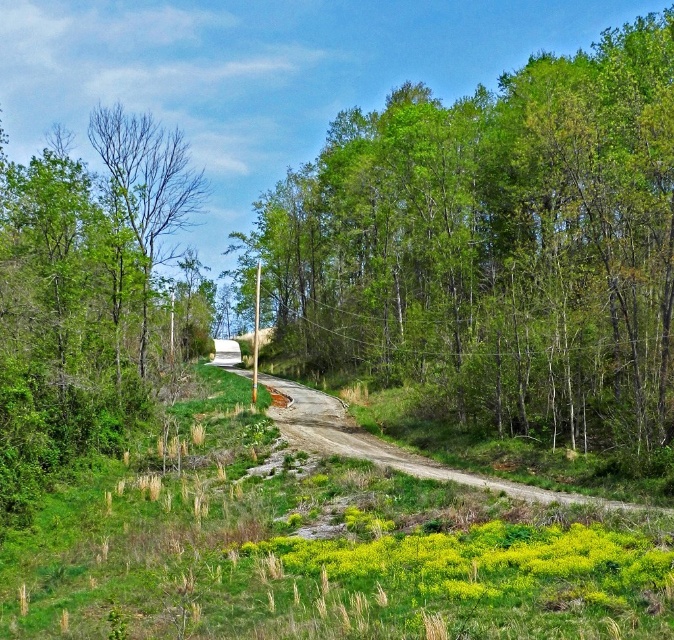
Who is positioned more to the left, green leafy tree at center or green leafy tree at left?

Positioned to the left is green leafy tree at left.

Based on the photo, is green leafy tree at center smaller than green leafy tree at left?

Incorrect, green leafy tree at center is not smaller in size than green leafy tree at left.

Between point (340, 236) and point (125, 289), which one is positioned in front?

Point (125, 289) is in front.

Find the location of a particular element. green leafy tree at center is located at coordinates (493, 248).

Is bare branches at left positioned in front of dirt/gravel path at center?

No, bare branches at left is further to the viewer.

Does bare branches at left appear on the right side of dirt/gravel path at center?

Incorrect, bare branches at left is not on the right side of dirt/gravel path at center.

Between point (115, 166) and point (642, 508), which one is positioned behind?

The point (115, 166) is more distant.

Find the location of a particular element. The image size is (674, 640). bare branches at left is located at coordinates (146, 188).

Is green leafy tree at left taller than bare branches at left?

Yes, green leafy tree at left is taller than bare branches at left.

Consider the image. Does green leafy tree at left have a lesser width compared to bare branches at left?

Incorrect, green leafy tree at left's width is not less than bare branches at left's.

Which is in front, point (156, 202) or point (150, 122)?

Point (156, 202) is more forward.

Identify the location of green leafy tree at left. (82, 294).